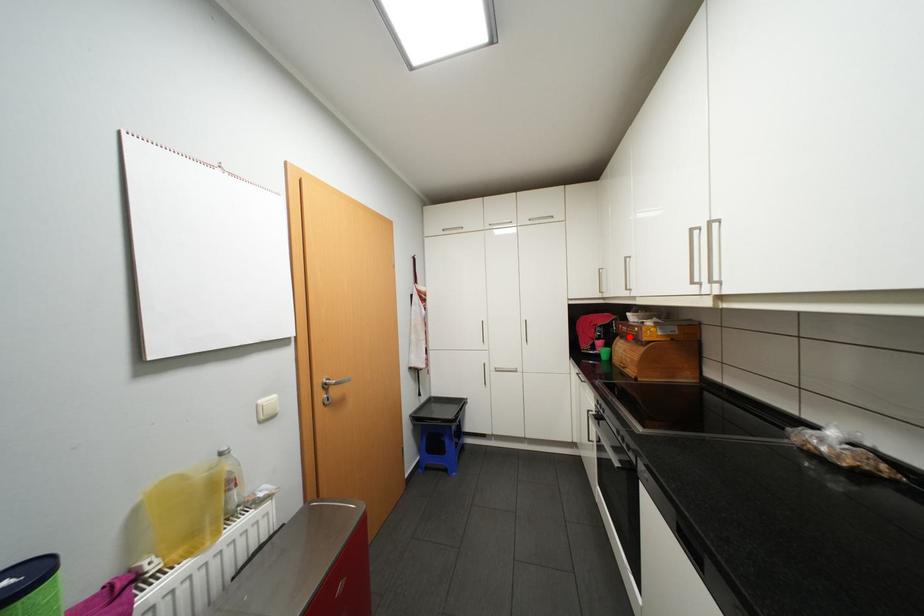
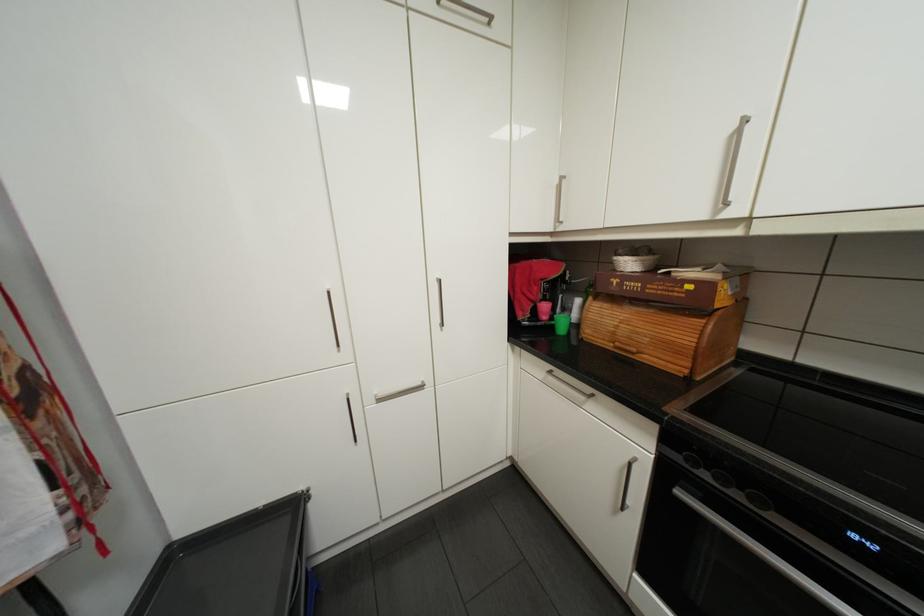
Locate, in the second image, the point that corresponds to the highlighted location in the first image.

(602, 297)